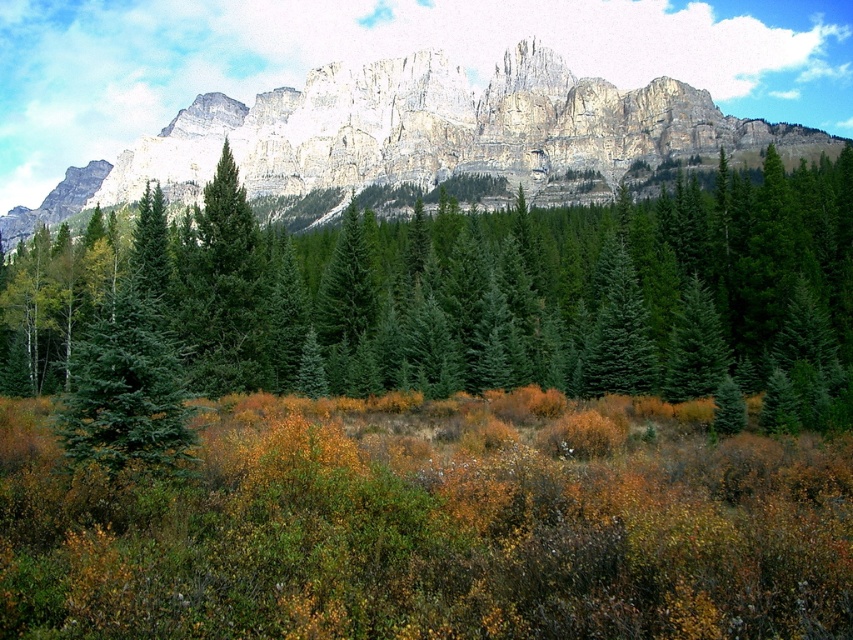
You are an environmental scientist assessing the landscape. You need to determine which object has a smaller width between the green matte evergreen tree at center and the rugged stone mountain at upper center. Based on the scene, what is your conclusion?

The green matte evergreen tree at center is thinner than the rugged stone mountain at upper center, so the green matte evergreen tree at center has a smaller width.

You are standing at the base of the mountains in the scene. There is a point marked at coordinates (x=524, y=291). What object is located at that point?

The point at coordinates (x=524, y=291) marks the green matte evergreen tree at center.